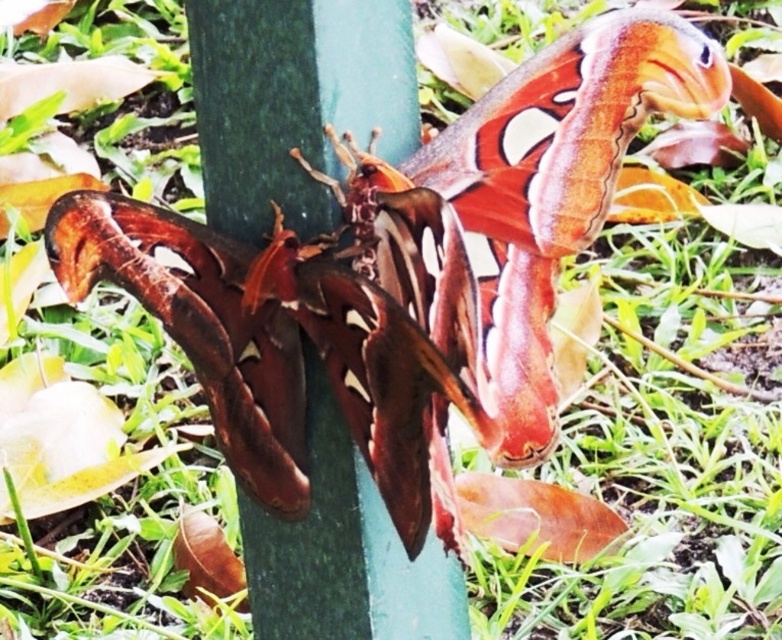
You are an entomologist observing the Atlas moths. You need to determine which object is wider between the green smooth pole at center and the matte brown butterfly at center. Which one is wider?

The matte brown butterfly at center is wider than the green smooth pole at center because the pole has a smaller width compared to the butterfly.

You are a photographer aiming to capture a closeup of the matte brown butterfly at center. You are currently positioned in front of the green smooth pole at center. Which object should you move closer to in order to focus on the butterfly?

You should move closer to the matte brown butterfly at center because it is farther away from you than the green smooth pole at center.